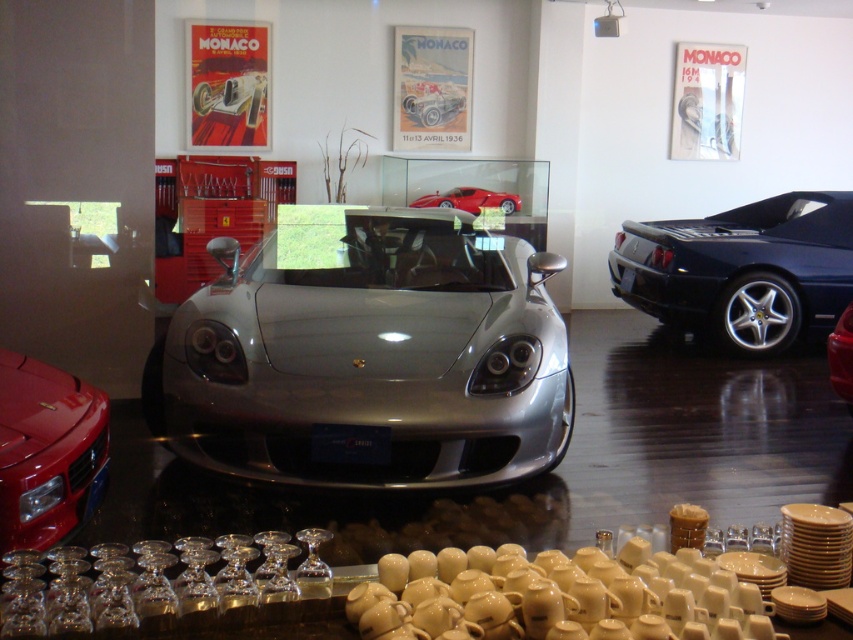
From the picture: You are a photographer setting up equipment in the showroom. You need to place a light source to the right of both the silver metallic sports car at center and the shiny red sports car at center. Is this possible given their current positions?

The silver metallic sports car at center is positioned on the left side of shiny red sports car at center, so placing a light source to the right of both cars is possible as they are aligned from left to right with space on their combined right side.

You are a photographer setting up a shoot in the showroom. You need to position a light source to the right of both the shiny red ferrari at lower left and the shiny black sports car at right. Is this possible?

The shiny red ferrari at lower left is to the left of the shiny black sports car at right, so positioning a light source to the right of both would require placing it beyond the shiny black sports car at right.